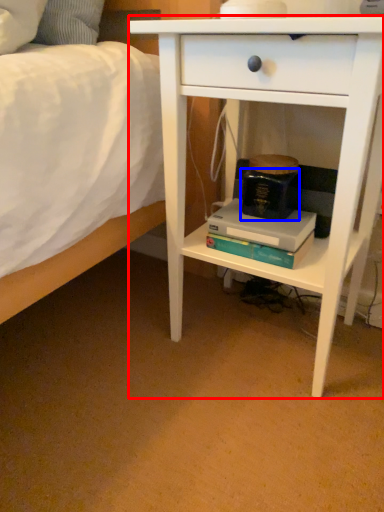
Question: Which object appears farthest to the camera in this image, nightstand (highlighted by a red box) or paperback book (highlighted by a blue box)?

Choices:
 (A) nightstand
 (B) paperback book

Answer: (B)